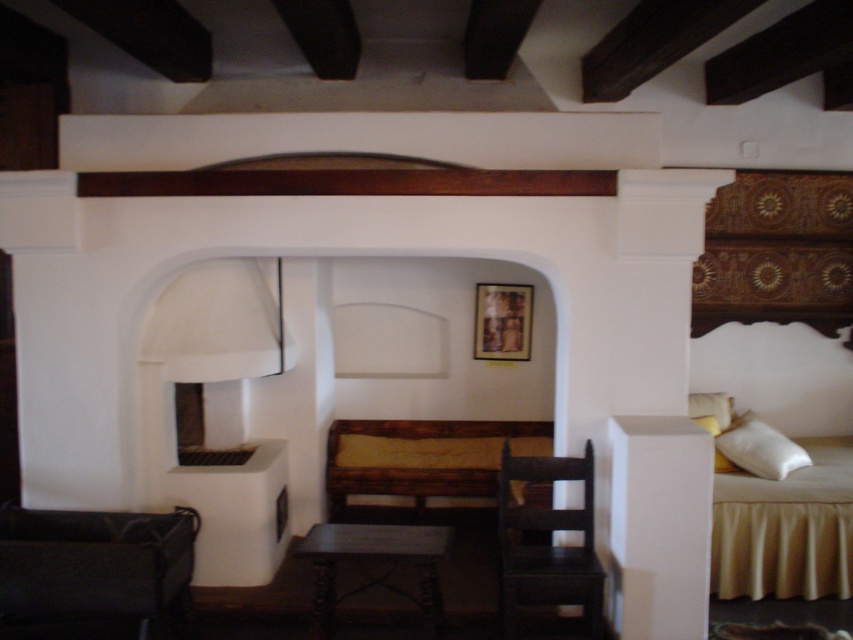
Which of these two, white matte pillar at right or wooden table at center, stands taller?

white matte pillar at right

Where is `white matte pillar at right`? The image size is (853, 640). white matte pillar at right is located at coordinates (659, 525).

In order to click on white matte pillar at right in this screenshot , I will do `click(659, 525)`.

You are a GUI agent. You are given a task and a screenshot of the screen. Output one action in this format:
    pyautogui.click(x=<x>, y=<y>)
    Task: Click on the white matte pillar at right
    The width and height of the screenshot is (853, 640).
    Given the screenshot: What is the action you would take?
    pyautogui.click(x=659, y=525)

Who is lower down, dark brown wooden bed at center or wooden table at center?

Positioned lower is wooden table at center.

Does dark brown wooden bed at center have a larger size compared to wooden table at center?

Correct, dark brown wooden bed at center is larger in size than wooden table at center.

What are the coordinates of `dark brown wooden bed at center` in the screenshot? It's located at (422, 458).

Locate an element on the screen. Image resolution: width=853 pixels, height=640 pixels. dark brown wooden bed at center is located at coordinates (422, 458).

Between point (166, 477) and point (329, 566), which one is positioned behind?

Point (166, 477)

This screenshot has height=640, width=853. Find the location of `white matte fireplace at left`. white matte fireplace at left is located at coordinates (212, 413).